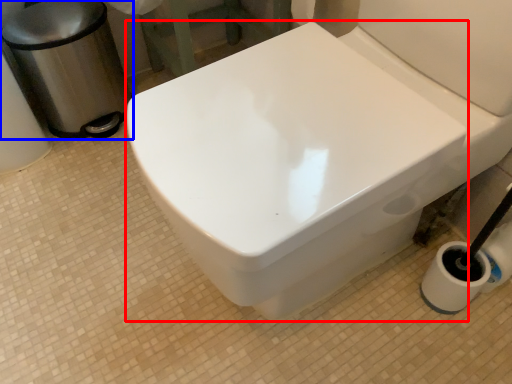
Question: Which of the following is the closest to the observer, bidet (highlighted by a red box) or garbage (highlighted by a blue box)?

Choices:
 (A) bidet
 (B) garbage

Answer: (A)